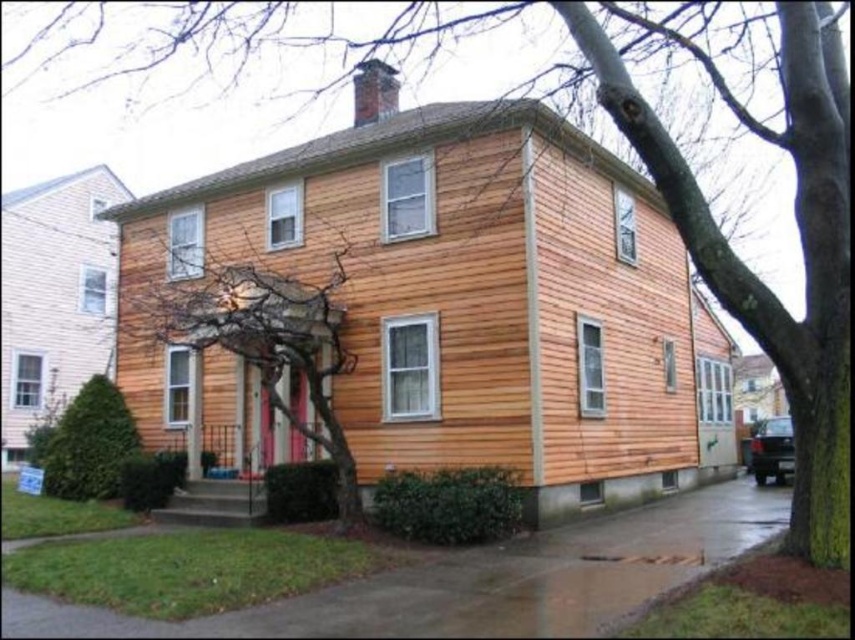
Which is below, brown textured tree at center or green leafy bush at lower left?

Positioned lower is green leafy bush at lower left.

Does brown textured tree at center have a greater height compared to green leafy bush at lower left?

In fact, brown textured tree at center may be shorter than green leafy bush at lower left.

I want to click on brown textured tree at center, so click(x=252, y=333).